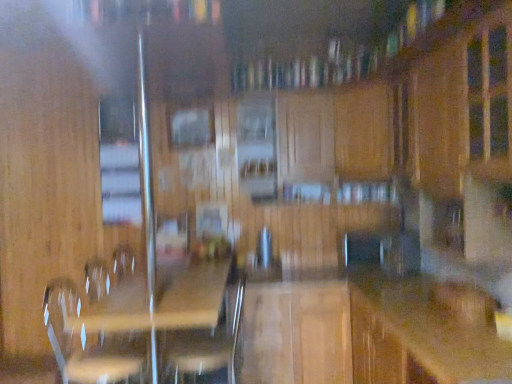
Image resolution: width=512 pixels, height=384 pixels. I want to click on wooden counter top at center, so click(441, 326).

This screenshot has height=384, width=512. What do you see at coordinates (441, 326) in the screenshot? I see `wooden counter top at center` at bounding box center [441, 326].

Locate an element on the screen. This screenshot has height=384, width=512. clear plastic swivel chair at lower left, the 2th swivel chair viewed from the right is located at coordinates (84, 342).

You are a GUI agent. You are given a task and a screenshot of the screen. Output one action in this format:
    pyautogui.click(x=<x>, y=<y>)
    Task: Click on the wooden counter top at center
    The width and height of the screenshot is (512, 384).
    Given the screenshot: What is the action you would take?
    pyautogui.click(x=441, y=326)

Is wooden swivel chair at center, arranged as the second swivel chair when viewed from the left, touching clear wood picnic table at center?

They are not placed beside each other.

Which is closer, (239, 284) or (102, 370)?

The point (102, 370) is more forward.

Is wooden swivel chair at center, arranged as the second swivel chair when viewed from the left, inside the boundaries of clear wood picnic table at center, or outside?

wooden swivel chair at center, arranged as the second swivel chair when viewed from the left, exists entirely within clear wood picnic table at center.

Is wooden swivel chair at center, the 1th swivel chair when ordered from right to left, to the left of clear wood picnic table at center from the viewer's perspective?

Incorrect, wooden swivel chair at center, the 1th swivel chair when ordered from right to left, is not on the left side of clear wood picnic table at center.

What's the angular difference between clear wood picnic table at center and wooden swivel chair at center, arranged as the second swivel chair when viewed from the left,'s facing directions?

88.4 degrees separate the facing orientations of clear wood picnic table at center and wooden swivel chair at center, arranged as the second swivel chair when viewed from the left.

From a real-world perspective, which is physically above, clear wood picnic table at center or wooden swivel chair at center, arranged as the second swivel chair when viewed from the left?

wooden swivel chair at center, arranged as the second swivel chair when viewed from the left.

Is clear wood picnic table at center positioned far away from wooden swivel chair at center, the 1th swivel chair when ordered from right to left?

They are positioned close to each other.

Which object is wider, clear wood picnic table at center or wooden counter top at center?

clear wood picnic table at center.

Is clear wood picnic table at center further to camera compared to wooden counter top at center?

Yes.

Can you confirm if clear wood picnic table at center is bigger than wooden counter top at center?

Yes, clear wood picnic table at center is bigger than wooden counter top at center.

From a real-world perspective, is clear wood picnic table at center physically located above or below wooden counter top at center?

In terms of real-world spatial position, clear wood picnic table at center is above wooden counter top at center.

Is clear plastic swivel chair at lower left, placed as the first swivel chair when sorted from left to right, spatially inside wooden counter top at center, or outside of it?

clear plastic swivel chair at lower left, placed as the first swivel chair when sorted from left to right, is not enclosed by wooden counter top at center.

Considering the relative positions of clear plastic swivel chair at lower left, the 2th swivel chair viewed from the right, and wooden counter top at center in the image provided, is clear plastic swivel chair at lower left, the 2th swivel chair viewed from the right, to the left of wooden counter top at center from the viewer's perspective?

Yes.

Considering the relative sizes of clear plastic swivel chair at lower left, the 2th swivel chair viewed from the right, and wooden counter top at center in the image provided, is clear plastic swivel chair at lower left, the 2th swivel chair viewed from the right, wider than wooden counter top at center?

No, clear plastic swivel chair at lower left, the 2th swivel chair viewed from the right, is not wider than wooden counter top at center.

From a real-world perspective, is clear plastic swivel chair at lower left, the 2th swivel chair viewed from the right, on wooden counter top at center?

Yes.

Which of these two, wooden counter top at center or clear wood picnic table at center, is smaller?

Smaller between the two is wooden counter top at center.

How far apart are wooden counter top at center and clear wood picnic table at center?

wooden counter top at center and clear wood picnic table at center are 1.32 meters apart from each other.

Does wooden counter top at center have a lesser width compared to clear wood picnic table at center?

Yes, wooden counter top at center is thinner than clear wood picnic table at center.

From the image's perspective, is wooden counter top at center on top of clear wood picnic table at center?

Actually, wooden counter top at center appears below clear wood picnic table at center in the image.

Considering the sizes of objects wooden counter top at center and clear plastic swivel chair at lower left, placed as the first swivel chair when sorted from left to right, in the image provided, who is wider, wooden counter top at center or clear plastic swivel chair at lower left, placed as the first swivel chair when sorted from left to right,?

With larger width is wooden counter top at center.

From a real-world perspective, between wooden counter top at center and clear plastic swivel chair at lower left, the 2th swivel chair viewed from the right, who is vertically lower?

From a 3D spatial view, wooden counter top at center is below.

Where is `counter top located below the clear plastic swivel chair at lower left, placed as the first swivel chair when sorted from left to right (from the image's perspective)`? The width and height of the screenshot is (512, 384). counter top located below the clear plastic swivel chair at lower left, placed as the first swivel chair when sorted from left to right (from the image's perspective) is located at coordinates (441, 326).

Which point is more distant from viewer, (428,313) or (57,281)?

The point (57,281) is farther from the camera.

Is wooden swivel chair at center, the 1th swivel chair when ordered from right to left, in contact with wooden counter top at center?

There is a gap between wooden swivel chair at center, the 1th swivel chair when ordered from right to left, and wooden counter top at center.

Is wooden swivel chair at center, arranged as the second swivel chair when viewed from the left, taller than wooden counter top at center?

No.

Which of these two, wooden swivel chair at center, the 1th swivel chair when ordered from right to left, or wooden counter top at center, is bigger?

Bigger between the two is wooden counter top at center.

Is point (241, 289) positioned after point (426, 308)?

Yes, it is behind point (426, 308).

At what (x,y) coordinates should I click in order to perform the action: click on picnic table beneath the wooden swivel chair at center, arranged as the second swivel chair when viewed from the left (from a real-world perspective). Please return your answer as a coordinate pair (x, y). Looking at the image, I should click on (155, 327).

Identify the location of swivel chair that is the 1st one above the clear wood picnic table at center (from a real-world perspective). (207, 347).

Looking at the image, which one is located further to clear plastic swivel chair at lower left, placed as the first swivel chair when sorted from left to right, wooden swivel chair at center, the 1th swivel chair when ordered from right to left, or clear wood picnic table at center?

The object further to clear plastic swivel chair at lower left, placed as the first swivel chair when sorted from left to right, is wooden swivel chair at center, the 1th swivel chair when ordered from right to left.

Which object lies nearer to the anchor point wooden swivel chair at center, the 1th swivel chair when ordered from right to left, clear wood picnic table at center or clear plastic swivel chair at lower left, the 2th swivel chair viewed from the right?

The object closer to wooden swivel chair at center, the 1th swivel chair when ordered from right to left, is clear wood picnic table at center.

Estimate the real-world distances between objects in this image. Which object is closer to clear wood picnic table at center, wooden swivel chair at center, the 1th swivel chair when ordered from right to left, or clear plastic swivel chair at lower left, the 2th swivel chair viewed from the right?

Based on the image, wooden swivel chair at center, the 1th swivel chair when ordered from right to left, appears to be nearer to clear wood picnic table at center.

Considering their positions, is clear plastic swivel chair at lower left, placed as the first swivel chair when sorted from left to right, positioned further to wooden counter top at center than clear wood picnic table at center?

clear plastic swivel chair at lower left, placed as the first swivel chair when sorted from left to right, is further to wooden counter top at center.

From the image, which object appears to be nearer to clear wood picnic table at center, clear plastic swivel chair at lower left, placed as the first swivel chair when sorted from left to right, or wooden swivel chair at center, arranged as the second swivel chair when viewed from the left?

Among the two, wooden swivel chair at center, arranged as the second swivel chair when viewed from the left, is located nearer to clear wood picnic table at center.

From the image, which object appears to be nearer to wooden swivel chair at center, arranged as the second swivel chair when viewed from the left, wooden counter top at center or clear plastic swivel chair at lower left, placed as the first swivel chair when sorted from left to right?

Based on the image, clear plastic swivel chair at lower left, placed as the first swivel chair when sorted from left to right, appears to be nearer to wooden swivel chair at center, arranged as the second swivel chair when viewed from the left.

Looking at this image, from the image, which object appears to be farther from wooden swivel chair at center, the 1th swivel chair when ordered from right to left, clear wood picnic table at center or wooden counter top at center?

wooden counter top at center lies further to wooden swivel chair at center, the 1th swivel chair when ordered from right to left, than the other object.

From the image, which object appears to be nearer to clear plastic swivel chair at lower left, placed as the first swivel chair when sorted from left to right, wooden counter top at center or clear wood picnic table at center?

clear wood picnic table at center.

I want to click on swivel chair between clear wood picnic table at center and wooden counter top at center in the horizontal direction, so click(207, 347).

At what (x,y) coordinates should I click in order to perform the action: click on picnic table between clear plastic swivel chair at lower left, the 2th swivel chair viewed from the right, and wooden counter top at center. Please return your answer as a coordinate pair (x, y). This screenshot has width=512, height=384. Looking at the image, I should click on (155, 327).

Locate an element on the screen. swivel chair situated between clear plastic swivel chair at lower left, placed as the first swivel chair when sorted from left to right, and wooden counter top at center from left to right is located at coordinates (207, 347).

Locate an element on the screen. picnic table located between clear plastic swivel chair at lower left, placed as the first swivel chair when sorted from left to right, and wooden swivel chair at center, arranged as the second swivel chair when viewed from the left, in the left-right direction is located at coordinates (155, 327).